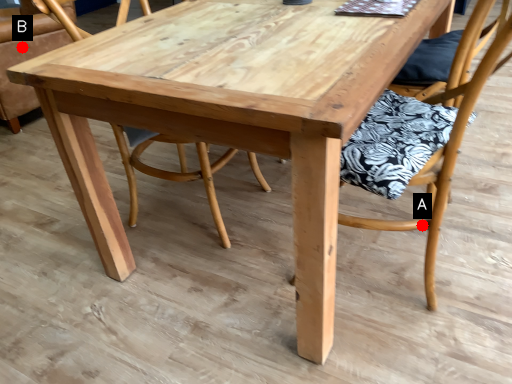
Question: Two points are circled on the image, labeled by A and B beside each circle. Which point is closer to the camera taking this photo?

Choices:
 (A) A is closer
 (B) B is closer

Answer: (A)